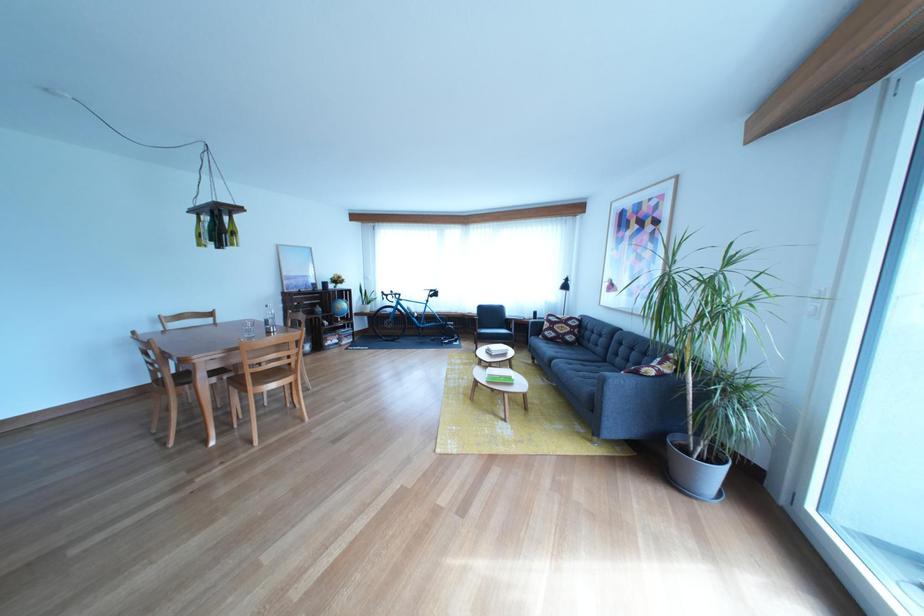
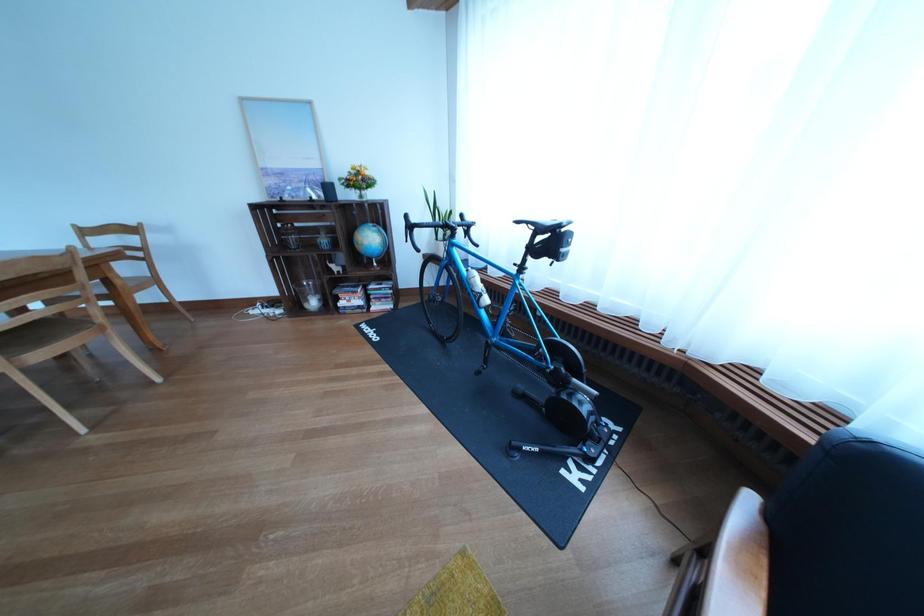
Locate, in the second image, the point that corresponds to (x=309, y=284) in the first image.

(294, 179)